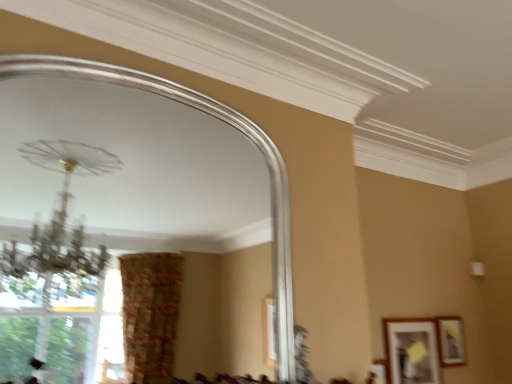
Question: Considering the positions of point (420, 319) and point (443, 334), is point (420, 319) closer or farther from the camera than point (443, 334)?

Choices:
 (A) closer
 (B) farther

Answer: (A)

Question: Is matte black picture frame at lower right, which is counted as the second picture frame, starting from the right, in front of or behind matte gold picture frame at lower right, placed as the 2th picture frame when sorted from left to right, in the image?

Choices:
 (A) front
 (B) behind

Answer: (A)

Question: Considering the real-world distances, which object is farthest from the matte black picture frame at lower right, the 1th picture frame from the left?

Choices:
 (A) silver metallic mirror at upper center
 (B) matte gold picture frame at lower right, placed as the 2th picture frame when sorted from left to right

Answer: (A)

Question: Considering the real-world distances, which object is closest to the matte black picture frame at lower right, the 1th picture frame from the left?

Choices:
 (A) matte gold picture frame at lower right, placed as the 2th picture frame when sorted from left to right
 (B) silver metallic mirror at upper center

Answer: (A)